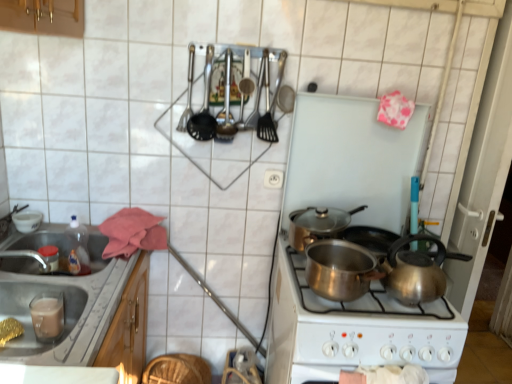
Question: Can you confirm if shiny silver pot at center, the first kitchen appliance when ordered from top to bottom, is shorter than white plastic electric outlet at center?

Choices:
 (A) yes
 (B) no

Answer: (B)

Question: Is shiny silver pot at center, the first kitchen appliance viewed from the back, far from white plastic electric outlet at center?

Choices:
 (A) no
 (B) yes

Answer: (A)

Question: Is shiny silver pot at center, the first kitchen appliance when ordered from top to bottom, oriented towards white plastic electric outlet at center?

Choices:
 (A) yes
 (B) no

Answer: (B)

Question: Is shiny silver pot at center, the second kitchen appliance when ordered from bottom to top, not within white plastic electric outlet at center?

Choices:
 (A) yes
 (B) no

Answer: (A)

Question: From a real-world perspective, does shiny silver pot at center, the 2th kitchen appliance when ordered from front to back, stand above white plastic electric outlet at center?

Choices:
 (A) no
 (B) yes

Answer: (A)

Question: In the image, is shiny silver pot at center, the second kitchen appliance when ordered from bottom to top, on the left side or the right side of white plastic electric outlet at center?

Choices:
 (A) left
 (B) right

Answer: (B)

Question: Would you say shiny silver pot at center, the first kitchen appliance when ordered from top to bottom, is inside or outside white plastic electric outlet at center?

Choices:
 (A) inside
 (B) outside

Answer: (B)

Question: Considering the positions of point (295, 241) and point (276, 180), is point (295, 241) closer or farther from the camera than point (276, 180)?

Choices:
 (A) closer
 (B) farther

Answer: (A)

Question: From a real-world perspective, is shiny silver pot at center, the first kitchen appliance when ordered from top to bottom, positioned above or below white plastic electric outlet at center?

Choices:
 (A) below
 (B) above

Answer: (A)

Question: From a real-world perspective, is satin silver pot at center, which appears as the second kitchen appliance when viewed from the back, physically located above or below white plastic electric outlet at center?

Choices:
 (A) below
 (B) above

Answer: (A)

Question: Relative to white plastic electric outlet at center, is satin silver pot at center, the 2th kitchen appliance from the top, in front or behind?

Choices:
 (A) behind
 (B) front

Answer: (B)

Question: In the image, is satin silver pot at center, the 2th kitchen appliance from the top, on the left side or the right side of white plastic electric outlet at center?

Choices:
 (A) right
 (B) left

Answer: (A)

Question: Is satin silver pot at center, which appears as the 1th kitchen appliance when viewed from the front, bigger or smaller than white plastic electric outlet at center?

Choices:
 (A) small
 (B) big

Answer: (B)

Question: Considering their positions, is shiny metallic kettle at center right located in front of or behind satin silver pot at center, arranged as the 1th kitchen appliance when ordered from the bottom?

Choices:
 (A) front
 (B) behind

Answer: (B)

Question: From the image's perspective, is shiny metallic kettle at center right above or below satin silver pot at center, the 2th kitchen appliance from the top?

Choices:
 (A) below
 (B) above

Answer: (B)